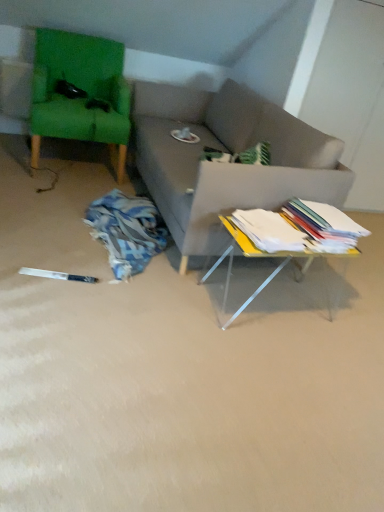
Image resolution: width=384 pixels, height=512 pixels. Find the location of `free region under white paper stack at center, arranged as the first book when viewed from the left (from a real-world perspective)`. free region under white paper stack at center, arranged as the first book when viewed from the left (from a real-world perspective) is located at coordinates [x=272, y=225].